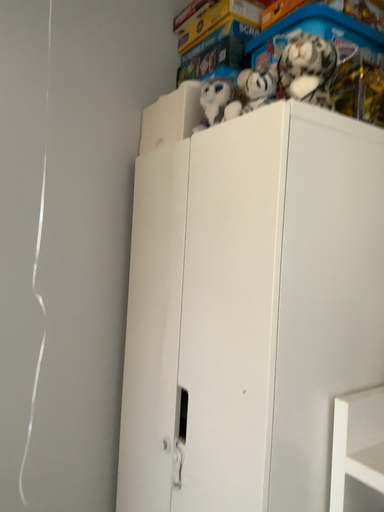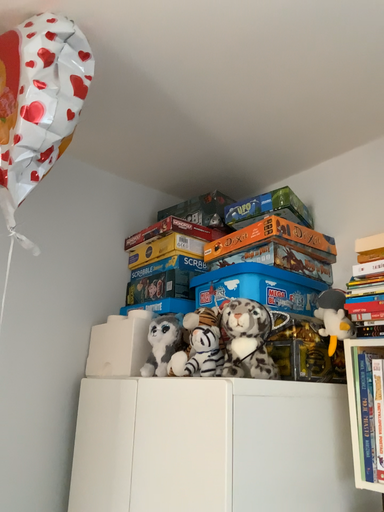
Question: How did the camera likely rotate when shooting the video?

Choices:
 (A) rotated left
 (B) rotated right

Answer: (B)